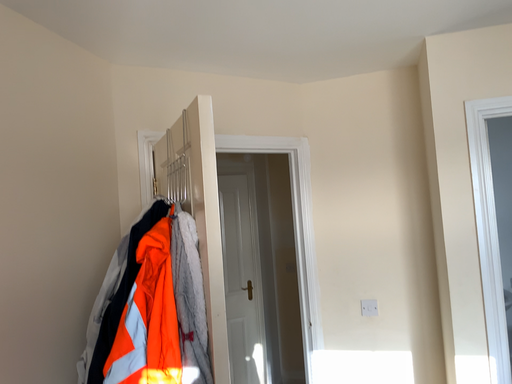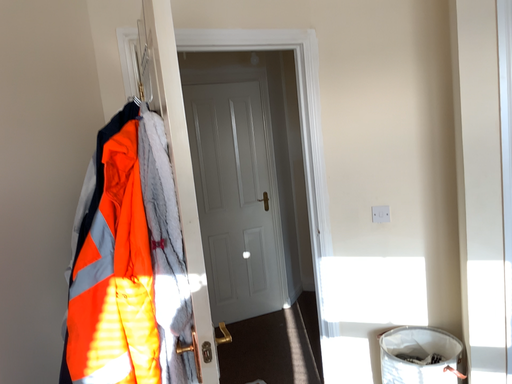
Question: Which way did the camera rotate in the video?

Choices:
 (A) rotated upward
 (B) rotated downward

Answer: (B)